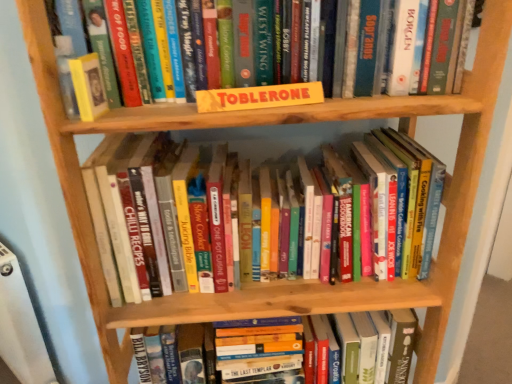
How much space does hardcover books at center, which is counted as the 2th book, starting from the top, occupy horizontally?

hardcover books at center, which is counted as the 2th book, starting from the top, is 21.36 centimeters wide.

This screenshot has height=384, width=512. Find the location of `hardcover book at center, which appears as the 1th book when ordered from the bottom`. hardcover book at center, which appears as the 1th book when ordered from the bottom is located at coordinates (133, 372).

Identify the location of hardcover book at upper left, marked as the 2th paperback book in a right-to-left arrangement. The image size is (512, 384). (88, 86).

Is yellow cardboard toblerone at center, acting as the second paperback book starting from the left, taller than hardcover book at center, which appears as the 1th book when ordered from the bottom?

Incorrect, the height of yellow cardboard toblerone at center, acting as the second paperback book starting from the left, is not larger of that of hardcover book at center, which appears as the 1th book when ordered from the bottom.

From the picture: From the image's perspective, relative to hardcover book at center, acting as the third book starting from the top, is yellow cardboard toblerone at center, the first paperback book when ordered from right to left, above or below?

From the image's perspective, yellow cardboard toblerone at center, the first paperback book when ordered from right to left, appears above hardcover book at center, acting as the third book starting from the top.

Which object is wider, yellow cardboard toblerone at center, acting as the second paperback book starting from the left, or hardcover book at center, acting as the third book starting from the top?

hardcover book at center, acting as the third book starting from the top, is wider.

Would you consider yellow cardboard toblerone at center, acting as the second paperback book starting from the left, to be distant from hardcover book at center, acting as the third book starting from the top?

No, yellow cardboard toblerone at center, acting as the second paperback book starting from the left, is in close proximity to hardcover book at center, acting as the third book starting from the top.

Who is shorter, hardcover books at center, which is the second book from bottom to top, or hardcover book at upper left, marked as the 2th paperback book in a right-to-left arrangement?

hardcover book at upper left, marked as the 2th paperback book in a right-to-left arrangement.

Consider the image. Considering the relative sizes of hardcover books at center, which is counted as the 2th book, starting from the top, and hardcover book at upper left, marked as the 2th paperback book in a right-to-left arrangement, in the image provided, is hardcover books at center, which is counted as the 2th book, starting from the top, thinner than hardcover book at upper left, marked as the 2th paperback book in a right-to-left arrangement,?

Incorrect, the width of hardcover books at center, which is counted as the 2th book, starting from the top, is not less than that of hardcover book at upper left, marked as the 2th paperback book in a right-to-left arrangement.

From a real-world perspective, is hardcover books at center, which is the second book from bottom to top, positioned under hardcover book at upper left, marked as the 2th paperback book in a right-to-left arrangement, based on gravity?

Indeed, from a real-world perspective, hardcover books at center, which is the second book from bottom to top, is positioned beneath hardcover book at upper left, marked as the 2th paperback book in a right-to-left arrangement.

Consider the image. Could hardcover books at center, which is the second book from bottom to top, be considered to be inside hardcover book at upper left, marked as the 2th paperback book in a right-to-left arrangement?

No, hardcover books at center, which is the second book from bottom to top, is located outside of hardcover book at upper left, marked as the 2th paperback book in a right-to-left arrangement.

Find the location of a particular element. The image size is (512, 384). the 1st book below the hardcover book at upper left, marked as the 2th paperback book in a right-to-left arrangement (from a real-world perspective) is located at coordinates (144, 221).

Does point (76, 91) lie in front of point (105, 224)?

Yes, point (76, 91) is in front of point (105, 224).

Between hardcover book at upper left, positioned as the first paperback book in left-to-right order, and hardcover books at center, which is the second book from bottom to top, which one has more height?

Standing taller between the two is hardcover books at center, which is the second book from bottom to top.

This screenshot has width=512, height=384. Identify the location of book behind the hardcover books at center, which is the second book from bottom to top. (133, 372).

Considering the sizes of objects hardcover books at center, which is counted as the 2th book, starting from the top, and hardcover book at center, which appears as the 1th book when ordered from the bottom, in the image provided, who is shorter, hardcover books at center, which is counted as the 2th book, starting from the top, or hardcover book at center, which appears as the 1th book when ordered from the bottom,?

hardcover book at center, which appears as the 1th book when ordered from the bottom.

Is hardcover books at center, which is counted as the 2th book, starting from the top, next to hardcover book at center, which appears as the 1th book when ordered from the bottom?

No, hardcover books at center, which is counted as the 2th book, starting from the top, is not in contact with hardcover book at center, which appears as the 1th book when ordered from the bottom.

Does hardcover books at center, which is the second book from bottom to top, have a lesser width compared to hardcover book at center, acting as the third book starting from the top?

Yes.

Would you say yellow cardboard toblerone at center, acting as the second paperback book starting from the left, is to the left or to the right of yellow cardboard sign at upper center, which ranks as the third book in bottom-to-top order, in the picture?

yellow cardboard toblerone at center, acting as the second paperback book starting from the left, is positioned on yellow cardboard sign at upper center, which ranks as the third book in bottom-to-top order,'s right side.

Considering the relative sizes of yellow cardboard toblerone at center, acting as the second paperback book starting from the left, and yellow cardboard sign at upper center, which ranks as the third book in bottom-to-top order, in the image provided, is yellow cardboard toblerone at center, acting as the second paperback book starting from the left, taller than yellow cardboard sign at upper center, which ranks as the third book in bottom-to-top order,?

Incorrect, the height of yellow cardboard toblerone at center, acting as the second paperback book starting from the left, is not larger of that of yellow cardboard sign at upper center, which ranks as the third book in bottom-to-top order.

Looking at this image, are yellow cardboard toblerone at center, the first paperback book when ordered from right to left, and yellow cardboard sign at upper center, which ranks as the third book in bottom-to-top order, making contact?

Yes, yellow cardboard toblerone at center, the first paperback book when ordered from right to left, is with yellow cardboard sign at upper center, which ranks as the third book in bottom-to-top order.

Which of these two, yellow cardboard toblerone at center, the first paperback book when ordered from right to left, or yellow cardboard sign at upper center, which ranks as the third book in bottom-to-top order, is wider?

yellow cardboard sign at upper center, which ranks as the third book in bottom-to-top order.

Considering their positions, is hardcover book at center, which appears as the 1th book when ordered from the bottom, located in front of or behind hardcover books at center, which is the second book from bottom to top?

hardcover book at center, which appears as the 1th book when ordered from the bottom, is behind hardcover books at center, which is the second book from bottom to top.

Between point (416, 332) and point (145, 236), which one is positioned behind?

The point (416, 332) is behind.

Looking at their sizes, would you say hardcover book at center, acting as the third book starting from the top, is wider or thinner than hardcover books at center, which is counted as the 2th book, starting from the top?

hardcover book at center, acting as the third book starting from the top, is wider than hardcover books at center, which is counted as the 2th book, starting from the top.

Identify the location of the 1st book above the hardcover book at center, which appears as the 1th book when ordered from the bottom (from the image's perspective). The width and height of the screenshot is (512, 384). (144, 221).

Looking at this image, how far apart are yellow cardboard sign at upper center, which appears as the 1th book when viewed from the top, and yellow cardboard toblerone at center, acting as the second paperback book starting from the left?

The distance of yellow cardboard sign at upper center, which appears as the 1th book when viewed from the top, from yellow cardboard toblerone at center, acting as the second paperback book starting from the left, is 3.72 inches.

Between yellow cardboard sign at upper center, which appears as the 1th book when viewed from the top, and yellow cardboard toblerone at center, acting as the second paperback book starting from the left, which one has smaller width?

Thinner between the two is yellow cardboard toblerone at center, acting as the second paperback book starting from the left.

How different are the orientations of yellow cardboard sign at upper center, which ranks as the third book in bottom-to-top order, and yellow cardboard toblerone at center, the first paperback book when ordered from right to left, in degrees?

The angle between the facing direction of yellow cardboard sign at upper center, which ranks as the third book in bottom-to-top order, and the facing direction of yellow cardboard toblerone at center, the first paperback book when ordered from right to left, is 8.54 degrees.

Considering the sizes of objects yellow cardboard sign at upper center, which ranks as the third book in bottom-to-top order, and yellow cardboard toblerone at center, the first paperback book when ordered from right to left, in the image provided, who is bigger, yellow cardboard sign at upper center, which ranks as the third book in bottom-to-top order, or yellow cardboard toblerone at center, the first paperback book when ordered from right to left,?

With larger size is yellow cardboard sign at upper center, which ranks as the third book in bottom-to-top order.

Image resolution: width=512 pixels, height=384 pixels. I want to click on book that is the 2nd one when counting backward from the yellow cardboard toblerone at center, the first paperback book when ordered from right to left, so click(x=133, y=372).

Locate an element on the screen. book that is the 1st object located below the hardcover book at upper left, marked as the 2th paperback book in a right-to-left arrangement (from the image's perspective) is located at coordinates (144, 221).

From the image, which object appears to be farther from hardcover book at upper left, marked as the 2th paperback book in a right-to-left arrangement, yellow cardboard sign at upper center, which ranks as the third book in bottom-to-top order, or yellow cardboard toblerone at center, the first paperback book when ordered from right to left?

The object further to hardcover book at upper left, marked as the 2th paperback book in a right-to-left arrangement, is yellow cardboard toblerone at center, the first paperback book when ordered from right to left.

Based on their spatial positions, is hardcover book at center, which appears as the 1th book when ordered from the bottom, or yellow cardboard toblerone at center, acting as the second paperback book starting from the left, further from hardcover books at center, which is counted as the 2th book, starting from the top?

Based on the image, hardcover book at center, which appears as the 1th book when ordered from the bottom, appears to be further to hardcover books at center, which is counted as the 2th book, starting from the top.

From the image, which object appears to be farther from hardcover book at upper left, positioned as the first paperback book in left-to-right order, yellow cardboard toblerone at center, the first paperback book when ordered from right to left, or yellow cardboard sign at upper center, which ranks as the third book in bottom-to-top order?

Among the two, yellow cardboard toblerone at center, the first paperback book when ordered from right to left, is located further to hardcover book at upper left, positioned as the first paperback book in left-to-right order.

When comparing their distances from hardcover books at center, which is counted as the 2th book, starting from the top, does yellow cardboard toblerone at center, the first paperback book when ordered from right to left, or yellow cardboard sign at upper center, which ranks as the third book in bottom-to-top order, seem closer?

The object closer to hardcover books at center, which is counted as the 2th book, starting from the top, is yellow cardboard sign at upper center, which ranks as the third book in bottom-to-top order.

Estimate the real-world distances between objects in this image. Which object is closer to hardcover books at center, which is the second book from bottom to top, yellow cardboard toblerone at center, the first paperback book when ordered from right to left, or hardcover book at upper left, positioned as the first paperback book in left-to-right order?

hardcover book at upper left, positioned as the first paperback book in left-to-right order, lies closer to hardcover books at center, which is the second book from bottom to top, than the other object.

Based on their spatial positions, is yellow cardboard toblerone at center, acting as the second paperback book starting from the left, or hardcover book at center, which appears as the 1th book when ordered from the bottom, closer to hardcover books at center, which is the second book from bottom to top?

yellow cardboard toblerone at center, acting as the second paperback book starting from the left, is closer to hardcover books at center, which is the second book from bottom to top.

Estimate the real-world distances between objects in this image. Which object is closer to hardcover book at upper left, positioned as the first paperback book in left-to-right order, hardcover book at center, acting as the third book starting from the top, or hardcover books at center, which is the second book from bottom to top?

Among the two, hardcover books at center, which is the second book from bottom to top, is located nearer to hardcover book at upper left, positioned as the first paperback book in left-to-right order.

Considering their positions, is hardcover books at center, which is the second book from bottom to top, positioned further to yellow cardboard sign at upper center, which ranks as the third book in bottom-to-top order, than hardcover book at center, acting as the third book starting from the top?

hardcover book at center, acting as the third book starting from the top, lies further to yellow cardboard sign at upper center, which ranks as the third book in bottom-to-top order, than the other object.

What are the coordinates of `paperback book between hardcover book at upper left, marked as the 2th paperback book in a right-to-left arrangement, and hardcover book at center, acting as the third book starting from the top, vertically` in the screenshot? It's located at (259, 97).

Where is `book between hardcover book at upper left, marked as the 2th paperback book in a right-to-left arrangement, and yellow cardboard toblerone at center, the first paperback book when ordered from right to left`? This screenshot has height=384, width=512. book between hardcover book at upper left, marked as the 2th paperback book in a right-to-left arrangement, and yellow cardboard toblerone at center, the first paperback book when ordered from right to left is located at coordinates (128, 52).

This screenshot has width=512, height=384. What are the coordinates of `paperback book situated between hardcover book at upper left, marked as the 2th paperback book in a right-to-left arrangement, and hardcover books at center, which is counted as the 2th book, starting from the top, from left to right` in the screenshot? It's located at (259, 97).

Find the location of a particular element. The image size is (512, 384). book between hardcover book at upper left, marked as the 2th paperback book in a right-to-left arrangement, and hardcover book at center, acting as the third book starting from the top, in the up-down direction is located at coordinates (144, 221).